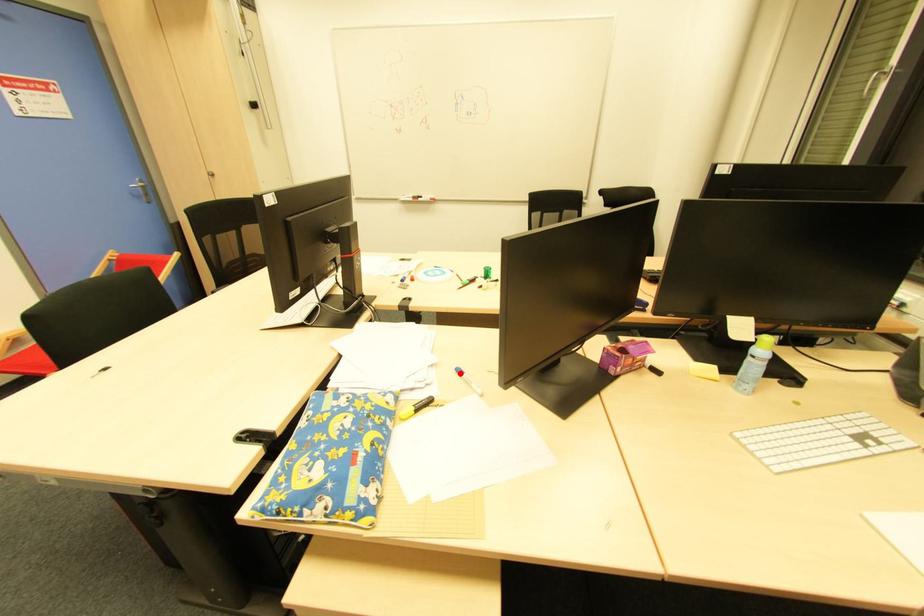
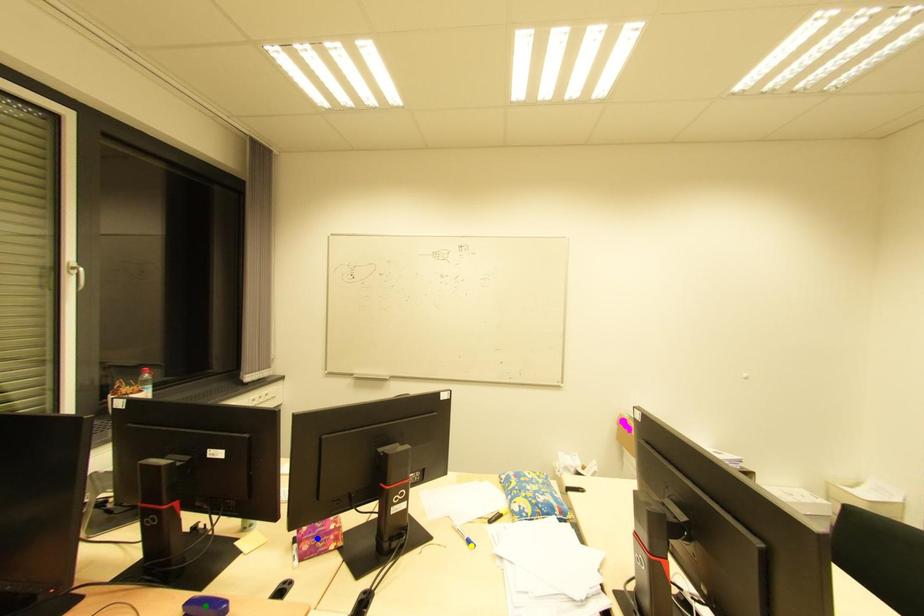
Question: I am providing you with two images of the same scene from different viewpoints. A red point is marked on the first image. You are given multiple points on the second image. Which point in image 2 is actually the same real-world point as the red point in image 1?

Choices:
 (A) blue point
 (B) green point
 (C) yellow point

Answer: (C)